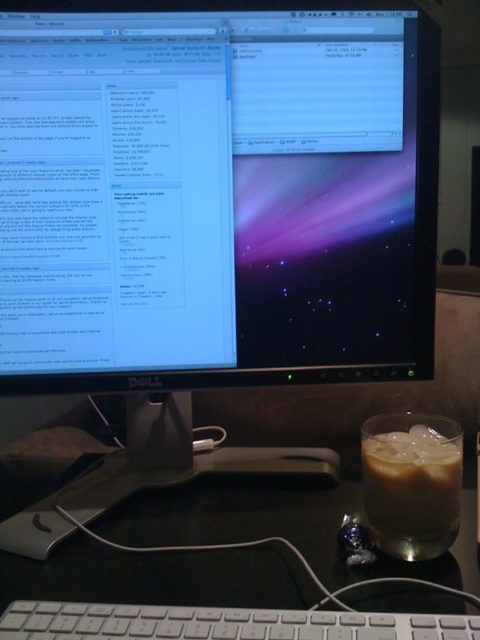
Question: Considering the real-world distances, which object is closest to the black plastic table at lower center?

Choices:
 (A) iced coffee at right
 (B) white plastic keyboard at bottom

Answer: (B)

Question: Among these points, which one is nearest to the camera?

Choices:
 (A) (177, 609)
 (B) (386, 428)

Answer: (A)

Question: Can you confirm if black plastic table at lower center is bigger than iced coffee at right?

Choices:
 (A) no
 (B) yes

Answer: (B)

Question: Is black plastic table at lower center below white plastic keyboard at bottom?

Choices:
 (A) yes
 (B) no

Answer: (B)

Question: From the image, what is the correct spatial relationship of black plastic table at lower center in relation to white plastic keyboard at bottom?

Choices:
 (A) left
 (B) right

Answer: (B)

Question: Which object is positioned farthest from the iced coffee at right?

Choices:
 (A) white plastic keyboard at bottom
 (B) black plastic table at lower center

Answer: (A)